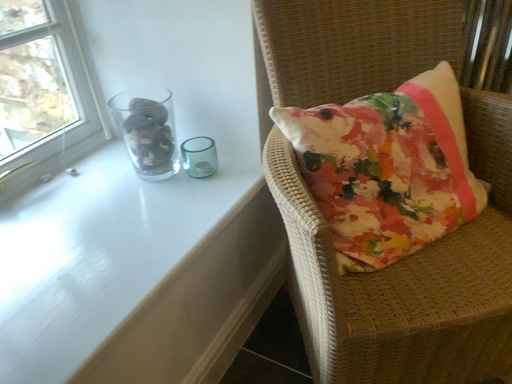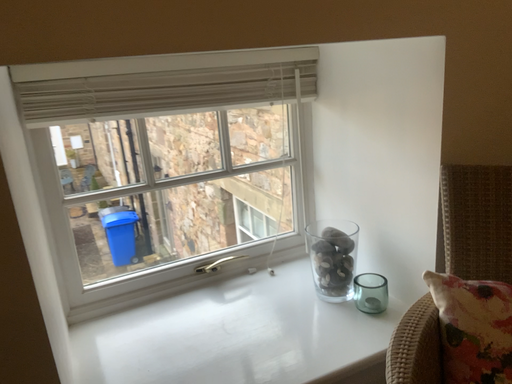
Question: Which way did the camera rotate in the video?

Choices:
 (A) rotated upward
 (B) rotated downward

Answer: (A)